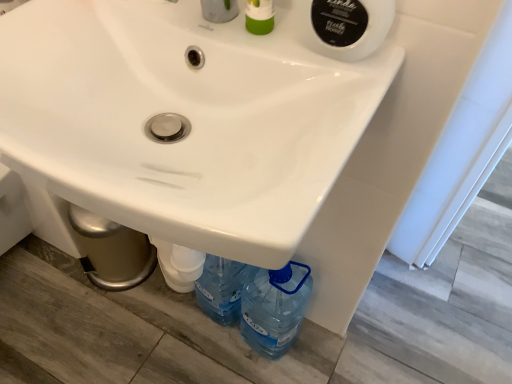
Question: Looking at their shapes, would you say white plastic pipe at lower center is wider or thinner than white glossy sink at center?

Choices:
 (A) wide
 (B) thin

Answer: (B)

Question: Considering the positions of white plastic pipe at lower center and white glossy sink at center in the image, is white plastic pipe at lower center bigger or smaller than white glossy sink at center?

Choices:
 (A) big
 (B) small

Answer: (B)

Question: Estimate the real-world distances between objects in this image. Which object is closer to the green plastic soap dispenser at upper center?

Choices:
 (A) white plastic pipe at lower center
 (B) white glossy sink at center

Answer: (B)

Question: Considering the real-world distances, which object is farthest from the green plastic soap dispenser at upper center?

Choices:
 (A) white plastic pipe at lower center
 (B) white glossy sink at center

Answer: (A)